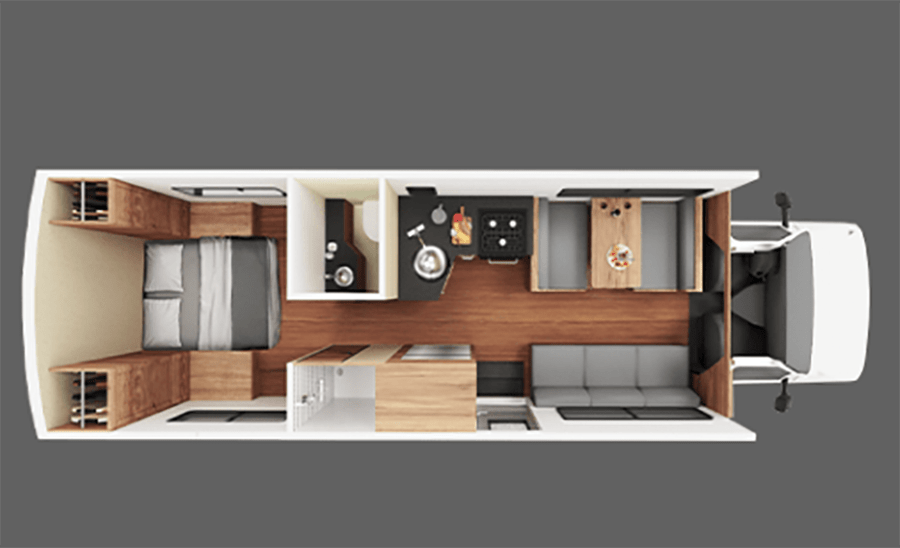
Find the location of a particular element. The image size is (900, 548). toilet is located at coordinates [x=365, y=237].